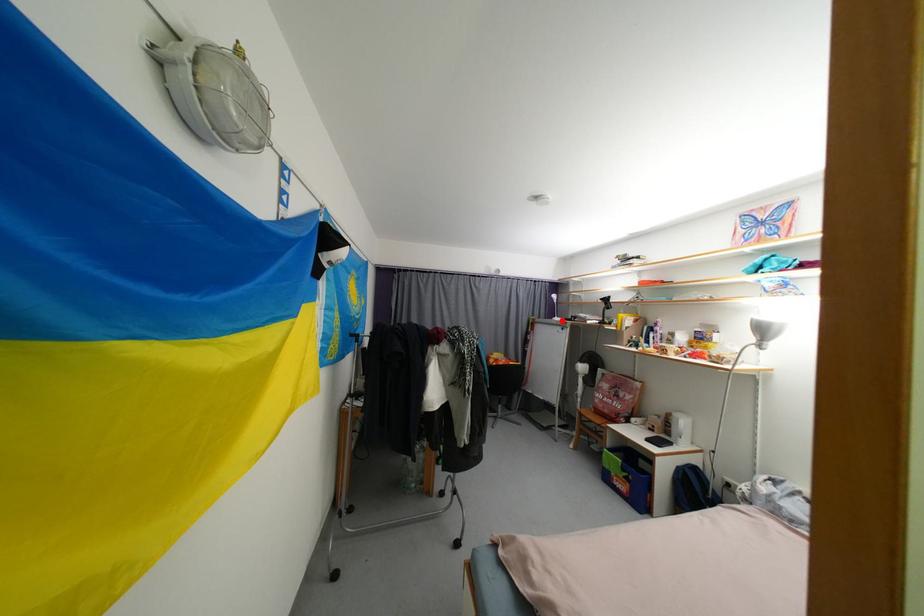
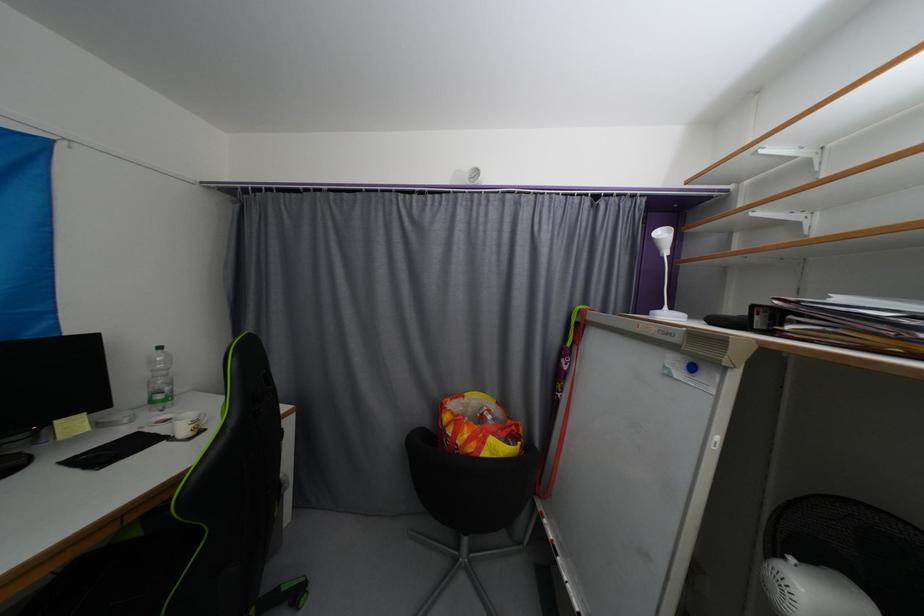
Locate, in the second image, the point that corresponds to the highlighted location in the first image.

(672, 317)